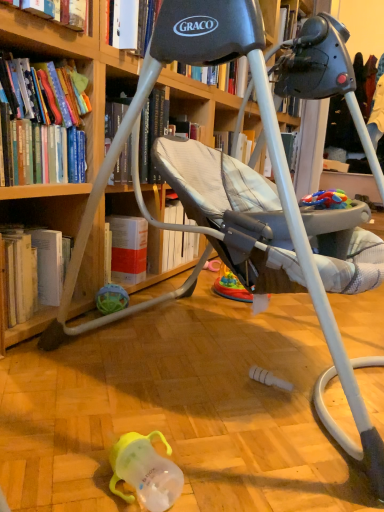
You are a GUI agent. You are given a task and a screenshot of the screen. Output one action in this format:
    pyautogui.click(x=<x>, y=<y>)
    Task: Click on the rubberized plastic toy at right, placed as the 1th toy when sorted from top to bottom
    The height and width of the screenshot is (512, 384).
    Given the screenshot: What is the action you would take?
    pos(326,200)

What do you see at coordinates (58, 11) in the screenshot? The height and width of the screenshot is (512, 384). I see `hardcover book at upper left, which appears as the first book when viewed from the top` at bounding box center [58, 11].

Image resolution: width=384 pixels, height=512 pixels. Identify the location of hardcover book at lower left, which is the 3th book from top to bottom. (38, 267).

The image size is (384, 512). What do you see at coordinates (111, 298) in the screenshot? I see `translucent rubber ball at lower left, the first toy ordered from the bottom` at bounding box center [111, 298].

At what (x,y) coordinates should I click in order to perform the action: click on rubberized plastic toy at right, the second toy in the back-to-front sequence. Please return your answer as a coordinate pair (x, y). The width and height of the screenshot is (384, 512). Looking at the image, I should click on pyautogui.click(x=326, y=200).

Find the location of a particular element. Image resolution: width=384 pixels, height=512 pixels. the 1st toy to the right of the hardcover book at lower left, which is the 3th book from top to bottom, counting from the anchor's position is located at coordinates (111, 298).

Does translucent rubber ball at lower left, which appears as the first toy when viewed from the left, appear on the left side of hardcover book at lower left, which is the 3th book from top to bottom?

In fact, translucent rubber ball at lower left, which appears as the first toy when viewed from the left, is to the right of hardcover book at lower left, which is the 3th book from top to bottom.

Is translucent rubber ball at lower left, which is the second toy from front to back, looking in the opposite direction of hardcover book at lower left, the first book when ordered from bottom to top?

No.

Considering the relative positions of translucent rubber ball at lower left, the 2th toy when ordered from top to bottom, and hardcover book at lower left, which is the 3th book from top to bottom, in the image provided, is translucent rubber ball at lower left, the 2th toy when ordered from top to bottom, in front of hardcover book at lower left, which is the 3th book from top to bottom,?

No.

What's the angular difference between translucent rubber ball at lower left, which is the second toy from front to back, and rubberized plastic toy at right, placed as the 1th toy when sorted from top to bottom,'s facing directions?

translucent rubber ball at lower left, which is the second toy from front to back, and rubberized plastic toy at right, placed as the 1th toy when sorted from top to bottom, are facing 10.7 degrees away from each other.

In terms of size, does translucent rubber ball at lower left, the first toy ordered from the bottom, appear bigger or smaller than rubberized plastic toy at right, which is the 2th toy in bottom-to-top order?

In the image, translucent rubber ball at lower left, the first toy ordered from the bottom, appears to be larger than rubberized plastic toy at right, which is the 2th toy in bottom-to-top order.

Is translucent rubber ball at lower left, which appears as the first toy when viewed from the left, next to rubberized plastic toy at right, the second toy in the back-to-front sequence, and touching it?

No, translucent rubber ball at lower left, which appears as the first toy when viewed from the left, is not beside rubberized plastic toy at right, the second toy in the back-to-front sequence.

Is hardcover book at upper left, acting as the third book starting from the bottom, far away from hardcover book at lower left, which is the 3th book from top to bottom?

No, hardcover book at upper left, acting as the third book starting from the bottom, is in close proximity to hardcover book at lower left, which is the 3th book from top to bottom.

Is hardcover book at upper left, acting as the third book starting from the bottom, facing towards hardcover book at lower left, the first book when ordered from bottom to top?

No, hardcover book at upper left, acting as the third book starting from the bottom, is not oriented towards hardcover book at lower left, the first book when ordered from bottom to top.

Between hardcover book at upper left, which appears as the first book when viewed from the top, and hardcover book at lower left, the first book when ordered from bottom to top, which one is positioned in front?

hardcover book at upper left, which appears as the first book when viewed from the top.

From a real-world perspective, between hardcover book at upper left, which appears as the first book when viewed from the top, and hardcover book at lower left, the first book when ordered from bottom to top, who is vertically lower?

From a 3D spatial view, hardcover book at lower left, the first book when ordered from bottom to top, is below.

From a real-world perspective, does hardcover book at lower left, which is the 3th book from top to bottom, sit lower than hardcover book at upper left, acting as the third book starting from the bottom?

Yes, from a real-world perspective, hardcover book at lower left, which is the 3th book from top to bottom, is below hardcover book at upper left, acting as the third book starting from the bottom.

Does point (69, 253) appear closer or farther from the camera than point (81, 18)?

Point (69, 253) is positioned farther from the camera compared to point (81, 18).

Identify the location of the 2nd book above the hardcover book at lower left, which is the 3th book from top to bottom (from the image's perspective). Image resolution: width=384 pixels, height=512 pixels. (58, 11).

Which of these two, hardcover book at lower left, which is the 3th book from top to bottom, or hardcover book at upper left, acting as the third book starting from the bottom, is smaller?

hardcover book at upper left, acting as the third book starting from the bottom.

From a real-world perspective, is translucent rubber ball at lower left, the first toy in the back-to-front sequence, positioned under hardcover book at upper left, acting as the third book starting from the bottom, based on gravity?

Yes, from a real-world perspective, translucent rubber ball at lower left, the first toy in the back-to-front sequence, is beneath hardcover book at upper left, acting as the third book starting from the bottom.

Can you confirm if translucent rubber ball at lower left, the 2th toy when ordered from top to bottom, is positioned to the left of hardcover book at upper left, acting as the third book starting from the bottom?

In fact, translucent rubber ball at lower left, the 2th toy when ordered from top to bottom, is to the right of hardcover book at upper left, acting as the third book starting from the bottom.

Who is taller, translucent rubber ball at lower left, the first toy ordered from the bottom, or hardcover book at upper left, acting as the third book starting from the bottom?

hardcover book at upper left, acting as the third book starting from the bottom, is taller.

Would you consider translucent rubber ball at lower left, which is the 2th toy in right-to-left order, to be distant from hardcover book at upper left, acting as the third book starting from the bottom?

They are positioned close to each other.

Which book is the 2nd one when counting from the left side of the translucent rubber ball at lower left, which is the second toy from front to back? Please provide its 2D coordinates.

[(41, 124)]

Between translucent rubber ball at lower left, the 2th toy when ordered from top to bottom, and hardcover book at upper left, marked as the 2th book in a bottom-to-top arrangement, which one appears on the left side from the viewer's perspective?

hardcover book at upper left, marked as the 2th book in a bottom-to-top arrangement, is more to the left.

Which is in front, translucent rubber ball at lower left, which is the second toy from front to back, or hardcover book at upper left, marked as the 2th book in a bottom-to-top arrangement?

hardcover book at upper left, marked as the 2th book in a bottom-to-top arrangement.

Which is correct: hardcover book at upper left, marked as the 2th book in a bottom-to-top arrangement, is inside rubberized plastic toy at right, placed as the 1th toy when sorted from top to bottom, or outside of it?

hardcover book at upper left, marked as the 2th book in a bottom-to-top arrangement, is outside rubberized plastic toy at right, placed as the 1th toy when sorted from top to bottom.

Does point (6, 139) come farther from viewer compared to point (319, 207)?

Yes, point (6, 139) is farther from viewer.

Between hardcover book at upper left, marked as the 2th book in a bottom-to-top arrangement, and rubberized plastic toy at right, which appears as the first toy when viewed from the right, which one appears on the right side from the viewer's perspective?

rubberized plastic toy at right, which appears as the first toy when viewed from the right, is more to the right.

Find the location of a particular element. Image resolution: width=384 pixels, height=512 pixels. toy beneath the hardcover book at lower left, the first book when ordered from bottom to top (from a real-world perspective) is located at coordinates (111, 298).

Locate an element on the screen. toy that appears on the left of rubberized plastic toy at right, the first toy when ordered from front to back is located at coordinates (111, 298).

Based on their spatial positions, is wooden bookcase at upper left or hardcover book at lower left, the first book when ordered from bottom to top, further from translucent rubber ball at lower left, the first toy in the back-to-front sequence?

wooden bookcase at upper left.

From the image, which object appears to be farther from hardcover book at upper left, acting as the third book starting from the bottom, hardcover book at upper left, which ranks as the second book in top-to-bottom order, or wooden bookcase at upper left?

wooden bookcase at upper left lies further to hardcover book at upper left, acting as the third book starting from the bottom, than the other object.

Which object lies further to the anchor point rubberized plastic toy at right, placed as the 1th toy when sorted from top to bottom, wooden bookcase at upper left or hardcover book at upper left, marked as the 2th book in a bottom-to-top arrangement?

hardcover book at upper left, marked as the 2th book in a bottom-to-top arrangement, is positioned further to the anchor rubberized plastic toy at right, placed as the 1th toy when sorted from top to bottom.

Which object lies nearer to the anchor point hardcover book at upper left, which ranks as the second book in top-to-bottom order, translucent rubber ball at lower left, the first toy ordered from the bottom, or hardcover book at upper left, acting as the third book starting from the bottom?

hardcover book at upper left, acting as the third book starting from the bottom.

Which object lies nearer to the anchor point hardcover book at lower left, the first book when ordered from bottom to top, translucent rubber ball at lower left, the first toy in the back-to-front sequence, or rubberized plastic toy at right, the second toy in the back-to-front sequence?

translucent rubber ball at lower left, the first toy in the back-to-front sequence, lies closer to hardcover book at lower left, the first book when ordered from bottom to top, than the other object.

Considering their positions, is hardcover book at upper left, marked as the 2th book in a bottom-to-top arrangement, positioned closer to translucent rubber ball at lower left, the first toy in the back-to-front sequence, than wooden bookcase at upper left?

wooden bookcase at upper left.

Looking at the image, which one is located further to wooden bookcase at upper left, hardcover book at upper left, which appears as the first book when viewed from the top, or rubberized plastic toy at right, the first toy when ordered from front to back?

rubberized plastic toy at right, the first toy when ordered from front to back.

Based on their spatial positions, is hardcover book at upper left, which appears as the first book when viewed from the top, or wooden bookcase at upper left further from hardcover book at lower left, which is the 3th book from top to bottom?

Based on the image, hardcover book at upper left, which appears as the first book when viewed from the top, appears to be further to hardcover book at lower left, which is the 3th book from top to bottom.

Identify the location of book between hardcover book at upper left, which appears as the first book when viewed from the top, and hardcover book at lower left, the first book when ordered from bottom to top, from top to bottom. The image size is (384, 512). click(41, 124).

Find the location of a particular element. The image size is (384, 512). toy between hardcover book at upper left, which ranks as the second book in top-to-bottom order, and rubberized plastic toy at right, which ranks as the second toy in left-to-right order, in the horizontal direction is located at coordinates (111, 298).

This screenshot has width=384, height=512. Find the location of `toy located between hardcover book at lower left, the first book when ordered from bottom to top, and rubberized plastic toy at right, which ranks as the second toy in left-to-right order, in the left-right direction`. toy located between hardcover book at lower left, the first book when ordered from bottom to top, and rubberized plastic toy at right, which ranks as the second toy in left-to-right order, in the left-right direction is located at coordinates (111, 298).

You are a GUI agent. You are given a task and a screenshot of the screen. Output one action in this format:
    pyautogui.click(x=<x>, y=<y>)
    Task: Click on the toy between wooden bookcase at upper left and translucent rubber ball at lower left, which is the 2th toy in right-to-left order, along the z-axis
    
    Given the screenshot: What is the action you would take?
    click(326, 200)